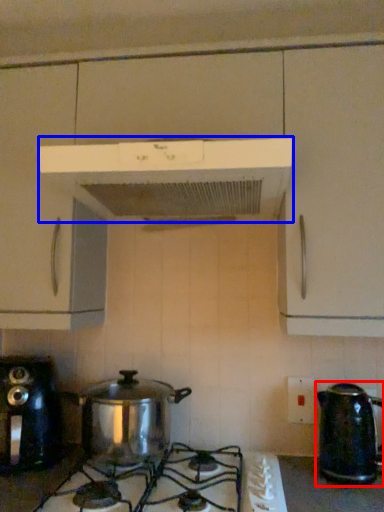
Question: Which point is further to the camera, kettle (highlighted by a red box) or home appliance (highlighted by a blue box)?

Choices:
 (A) kettle
 (B) home appliance

Answer: (A)